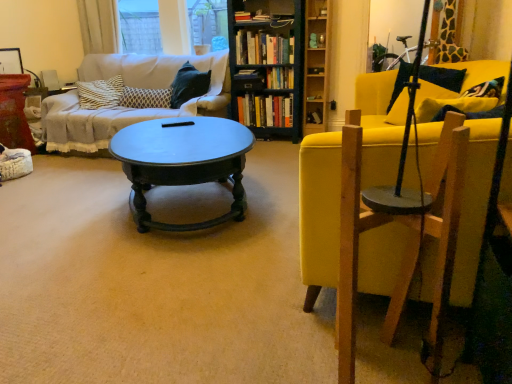
In order to click on vacant area situated below shiny dark wood coffee table at center (from a real-world perspective) in this screenshot , I will do `click(196, 202)`.